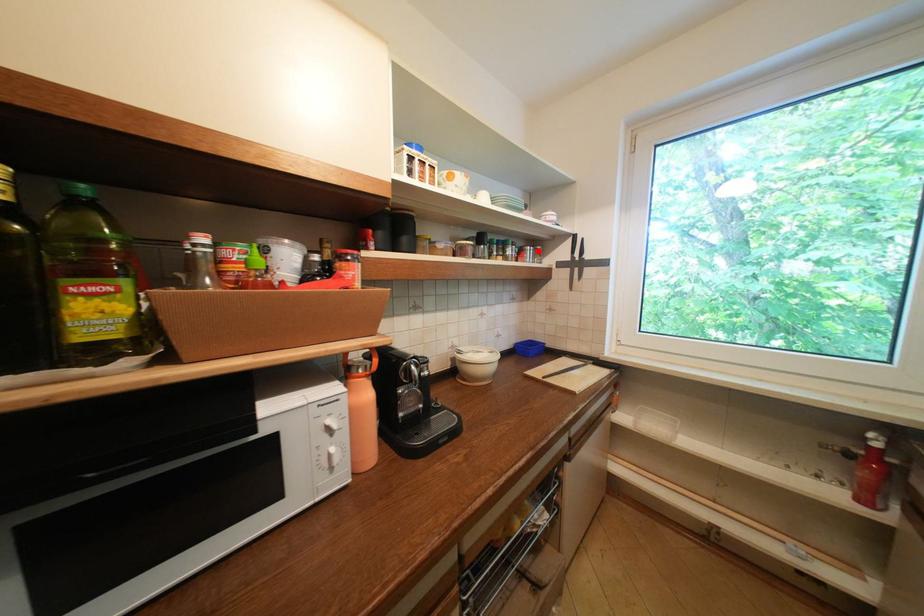
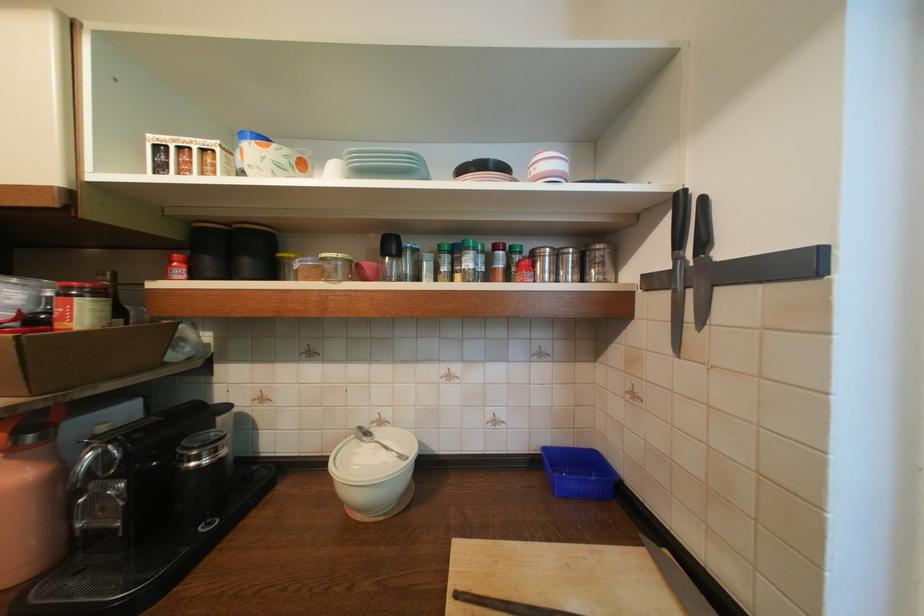
In the second image, find the point that corresponds to the highlighted location in the first image.

(565, 256)